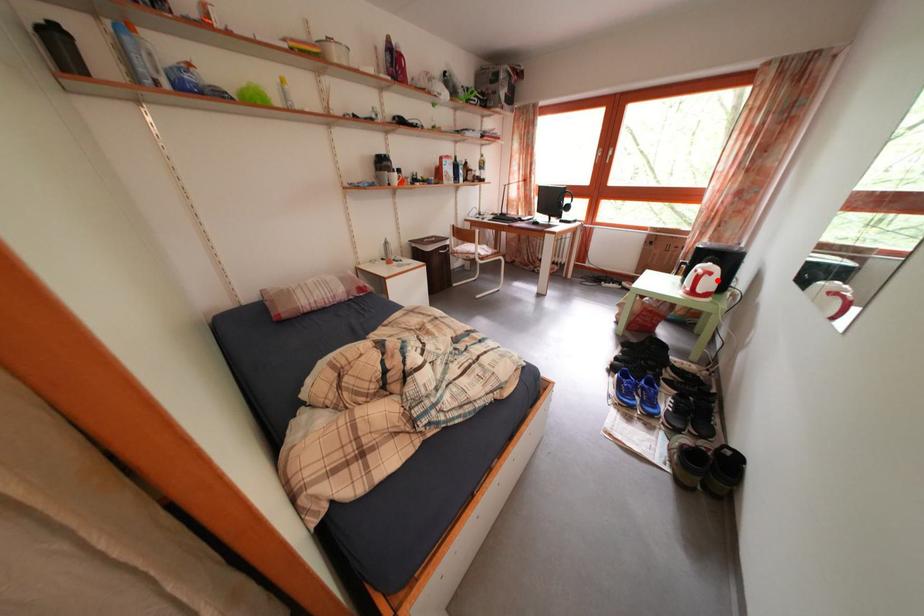
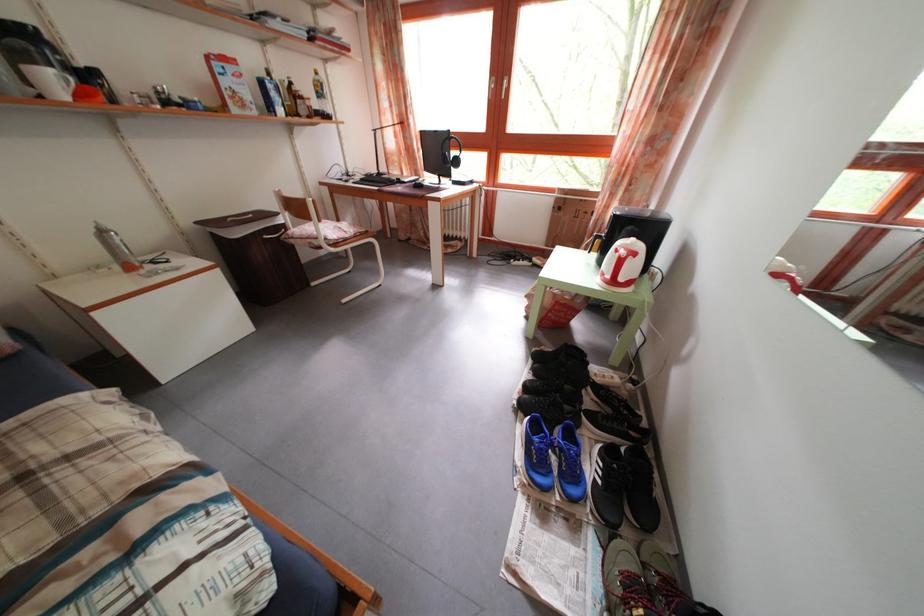
The point at the highlighted location is marked in the first image. Where is the corresponding point in the second image?

(641, 262)